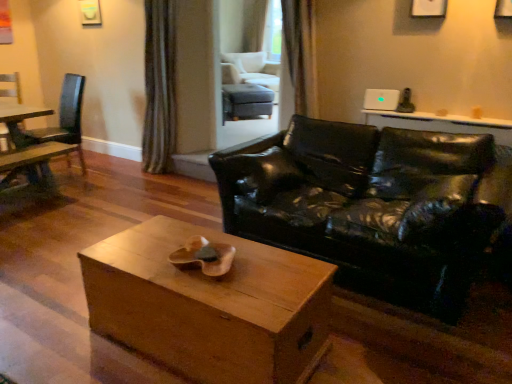
Question: Considering the relative sizes of green textured curtain at upper center, the 2th curtain in the front-to-back sequence, and wooden box at center in the image provided, is green textured curtain at upper center, the 2th curtain in the front-to-back sequence, smaller than wooden box at center?

Choices:
 (A) yes
 (B) no

Answer: (A)

Question: Considering the relative positions of green textured curtain at upper center, positioned as the 2th curtain in right-to-left order, and wooden box at center in the image provided, is green textured curtain at upper center, positioned as the 2th curtain in right-to-left order, to the left of wooden box at center from the viewer's perspective?

Choices:
 (A) yes
 (B) no

Answer: (A)

Question: From a real-world perspective, is green textured curtain at upper center, positioned as the 2th curtain in right-to-left order, over wooden box at center?

Choices:
 (A) no
 (B) yes

Answer: (B)

Question: Does green textured curtain at upper center, the 2th curtain in the front-to-back sequence, have a larger size compared to wooden box at center?

Choices:
 (A) no
 (B) yes

Answer: (A)

Question: Is wooden box at center at the back of green textured curtain at upper center, which is the first curtain in left-to-right order?

Choices:
 (A) yes
 (B) no

Answer: (B)

Question: From the image's perspective, is wooden box at center above or below satin curtain at upper center, the 1th curtain from the front?

Choices:
 (A) below
 (B) above

Answer: (A)

Question: Is wooden box at center situated inside satin curtain at upper center, acting as the second curtain starting from the left, or outside?

Choices:
 (A) outside
 (B) inside

Answer: (A)

Question: Is point (202, 284) positioned closer to the camera than point (307, 59)?

Choices:
 (A) closer
 (B) farther

Answer: (A)

Question: Considering the positions of wooden box at center and satin curtain at upper center, the first curtain in the right-to-left sequence, in the image, is wooden box at center bigger or smaller than satin curtain at upper center, the first curtain in the right-to-left sequence,?

Choices:
 (A) small
 (B) big

Answer: (B)

Question: Is green textured curtain at upper center, positioned as the 2th curtain in right-to-left order, wider or thinner than matte gray ottoman at center, which is the first chair in back-to-front order?

Choices:
 (A) wide
 (B) thin

Answer: (B)

Question: Considering the positions of point (159, 135) and point (272, 99), is point (159, 135) closer or farther from the camera than point (272, 99)?

Choices:
 (A) farther
 (B) closer

Answer: (B)

Question: From the image's perspective, is green textured curtain at upper center, the 2th curtain in the front-to-back sequence, above or below matte gray ottoman at center, marked as the first chair in a right-to-left arrangement?

Choices:
 (A) above
 (B) below

Answer: (B)

Question: Would you say green textured curtain at upper center, the 2th curtain in the front-to-back sequence, is inside or outside matte gray ottoman at center, the 3th chair from the left?

Choices:
 (A) inside
 (B) outside

Answer: (B)

Question: From a real-world perspective, is wooden bench at left physically located above or below matte gray ottoman at center, which is the first chair in back-to-front order?

Choices:
 (A) below
 (B) above

Answer: (A)

Question: Is wooden bench at left in front of or behind matte gray ottoman at center, marked as the first chair in a right-to-left arrangement, in the image?

Choices:
 (A) behind
 (B) front

Answer: (B)